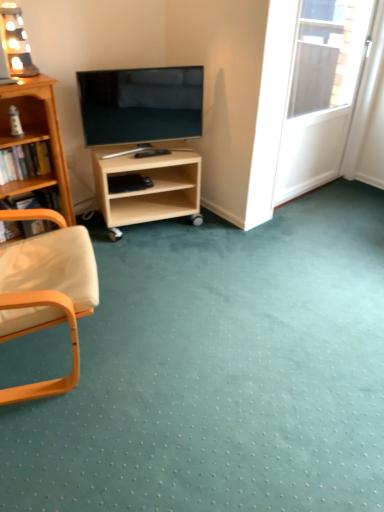
In order to click on free point behind wooden armchair at left in this screenshot , I will do `click(134, 266)`.